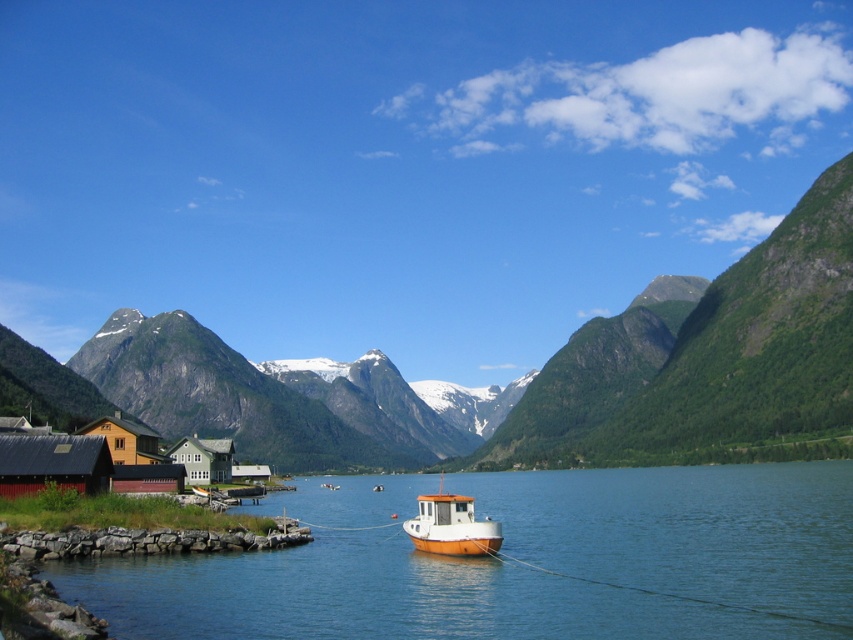
Can you confirm if matte red barn at lower left is bigger than orange matte boat at center?

Incorrect, matte red barn at lower left is not larger than orange matte boat at center.

Which is behind, point (86, 445) or point (415, 540)?

The point (86, 445) is behind.

The height and width of the screenshot is (640, 853). Find the location of `matte red barn at lower left`. matte red barn at lower left is located at coordinates (53, 461).

Where is `matte red barn at lower left`? The image size is (853, 640). matte red barn at lower left is located at coordinates (53, 461).

Who is positioned more to the right, clear blue water at lower left or orange matte boat at center?

clear blue water at lower left is more to the right.

What are the coordinates of `clear blue water at lower left` in the screenshot? It's located at (517, 561).

Is matte red barn at lower left thinner than green matte house at lower left?

Yes, matte red barn at lower left is thinner than green matte house at lower left.

Between point (73, 449) and point (230, 456), which one is positioned in front?

Point (73, 449)

Image resolution: width=853 pixels, height=640 pixels. What do you see at coordinates (53, 461) in the screenshot?
I see `matte red barn at lower left` at bounding box center [53, 461].

The image size is (853, 640). I want to click on matte red barn at lower left, so click(x=53, y=461).